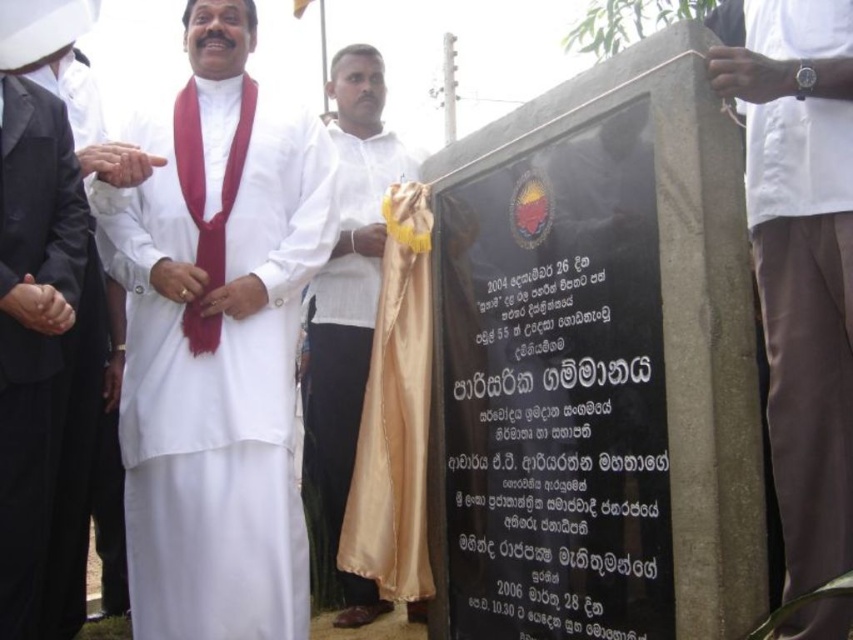
Question: Which point is farther to the camera?

Choices:
 (A) (343, 300)
 (B) (4, 77)
 (C) (724, 28)
 (D) (215, 634)

Answer: (A)

Question: Can you confirm if black satin robe at left is wider than silky red tie at left?

Choices:
 (A) no
 (B) yes

Answer: (A)

Question: Which point is closer to the camera?

Choices:
 (A) (352, 340)
 (B) (802, 44)
 (C) (12, 237)

Answer: (B)

Question: Among these points, which one is nearest to the camera?

Choices:
 (A) (354, 96)
 (B) (802, 513)

Answer: (B)

Question: Is white smooth shirt at right smaller than silky red tie at left?

Choices:
 (A) yes
 (B) no

Answer: (B)

Question: Can you confirm if white smooth shirt at right is positioned to the right of silky red tie at left?

Choices:
 (A) no
 (B) yes

Answer: (B)